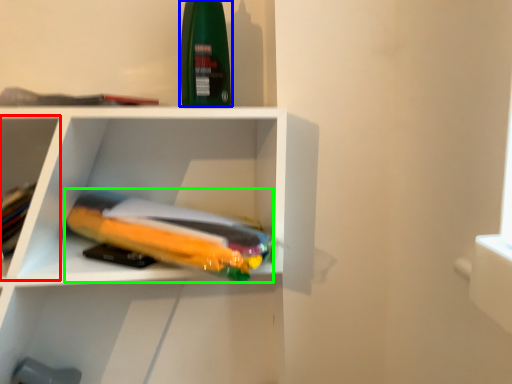
Question: Which is farther away from shelf (highlighted by a red box)? cleaning product (highlighted by a blue box) or book (highlighted by a green box)?

Choices:
 (A) cleaning product
 (B) book

Answer: (A)